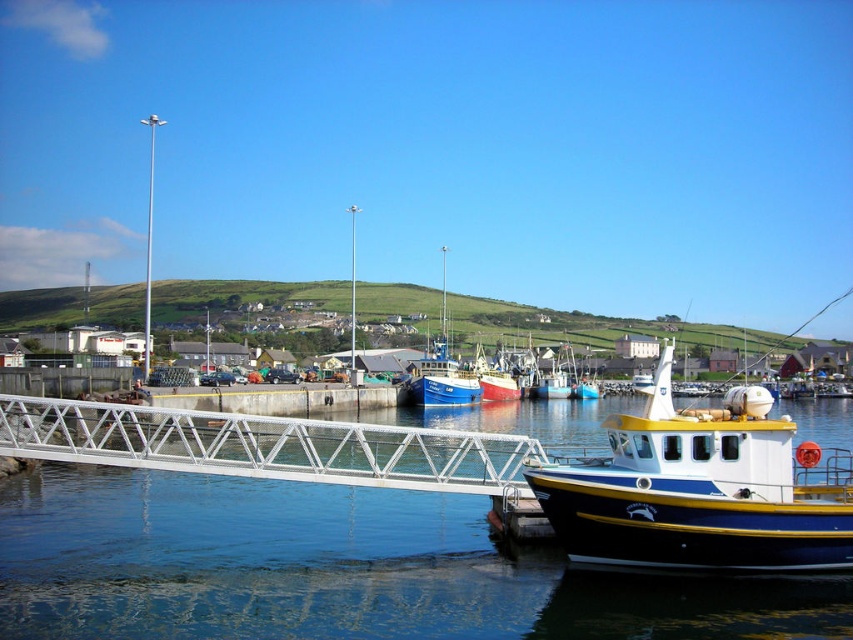
You are a boat captain planning to dock your vessel at the harbor. You need to know if there is enough space between the blue glossy water at lower center and the concrete dock at center to maneuver your boat. Can you determine if the space is sufficient?

The blue glossy water at lower center has a larger size compared to the concrete dock at center, so there is enough space to maneuver your boat between them.

You are a harbor worker needing to move a heavy crate from the blue polished wood boat at lower right to the concrete dock at center. Based on the scene, can you directly move the crate from the boat to the dock without needing to use any ramps or equipment?

The blue polished wood boat at lower right is in front of the concrete dock at center, meaning there is a direct path between them. Therefore, you can move the crate directly without needing ramps or equipment.

You are standing on the shore and see the blue glossy water at lower center and the concrete dock at center. Which object is closer to you?

The blue glossy water at lower center is closer to you because it is in front of the concrete dock at center.